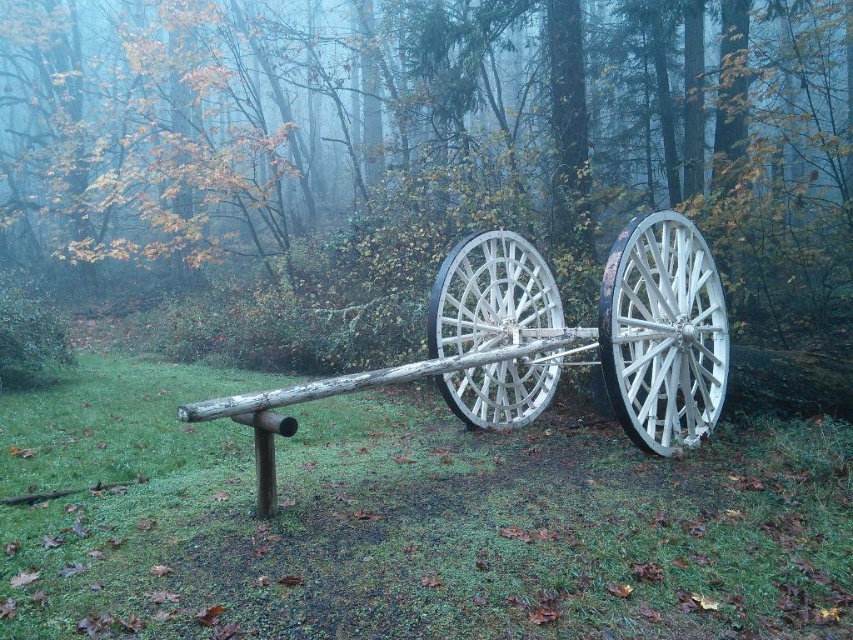
Question: Can you confirm if green matte wood at center is smaller than white wooden wagon wheel at right?

Choices:
 (A) yes
 (B) no

Answer: (B)

Question: In this image, where is white wooden cart at center located relative to white wooden wheel at center?

Choices:
 (A) above
 (B) below

Answer: (A)

Question: Estimate the real-world distances between objects in this image. Which object is farther from the white wooden cart at center?

Choices:
 (A) white wooden wheel at center
 (B) green matte wood at center
 (C) white wooden wagon wheel at right

Answer: (B)

Question: Which object is farther from the camera taking this photo?

Choices:
 (A) white wooden wheel at center
 (B) white wooden wagon wheel at right
 (C) green matte wood at center

Answer: (C)

Question: Which object appears closest to the camera in this image?

Choices:
 (A) white wooden wagon wheel at right
 (B) white wooden wheel at center
 (C) green matte wood at center
 (D) white wooden cart at center

Answer: (A)

Question: Is green matte wood at center wider than white wooden cart at center?

Choices:
 (A) no
 (B) yes

Answer: (B)